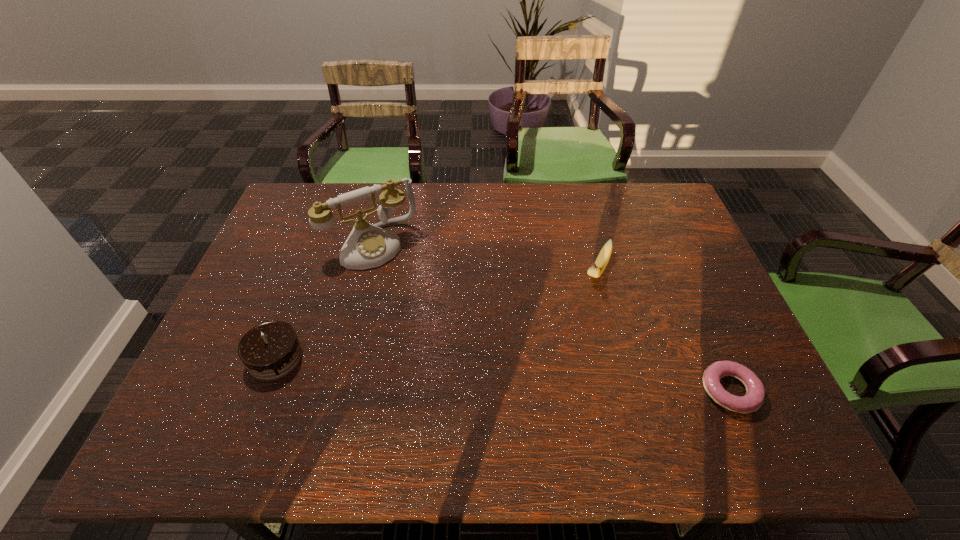
At what (x,y) coordinates should I click in order to perform the action: click on vacant area that lies between the chocolate cake and the doughnut. Please return your answer as a coordinate pair (x, y). Looking at the image, I should click on (502, 374).

At what (x,y) coordinates should I click in order to perform the action: click on free space between the chocolate cake and the tallest object. Please return your answer as a coordinate pair (x, y). The image size is (960, 540). Looking at the image, I should click on (324, 301).

You are a GUI agent. You are given a task and a screenshot of the screen. Output one action in this format:
    pyautogui.click(x=<x>, y=<y>)
    Task: Click on the free area in between the chocolate cake and the third object from left to right
    This screenshot has width=960, height=540.
    Given the screenshot: What is the action you would take?
    pyautogui.click(x=437, y=314)

Identify the location of empty location between the rightmost object and the telephone. This screenshot has width=960, height=540. (551, 318).

Locate an element on the screen. The width and height of the screenshot is (960, 540). unoccupied position between the telephone and the chocolate cake is located at coordinates (324, 301).

Locate an element on the screen. The width and height of the screenshot is (960, 540). free space between the rightmost object and the second object from right to left is located at coordinates (663, 331).

This screenshot has height=540, width=960. I want to click on empty location between the third object from left to right and the tallest object, so click(485, 258).

Image resolution: width=960 pixels, height=540 pixels. What are the coordinates of `object that stands as the second closest to the rightmost object` in the screenshot? It's located at click(x=368, y=246).

Identify which object is the third closest to the shortest object. Please provide its 2D coordinates. Your answer should be formatted as a tuple, i.e. [(x, y)], where the tuple contains the x and y coordinates of a point satisfying the conditions above.

[(271, 350)]

Find the location of `free space that satisfies the following two spatial constraints: 1. on the front side of the doughnut; 2. on the right side of the chocolate cake`. free space that satisfies the following two spatial constraints: 1. on the front side of the doughnut; 2. on the right side of the chocolate cake is located at coordinates (263, 391).